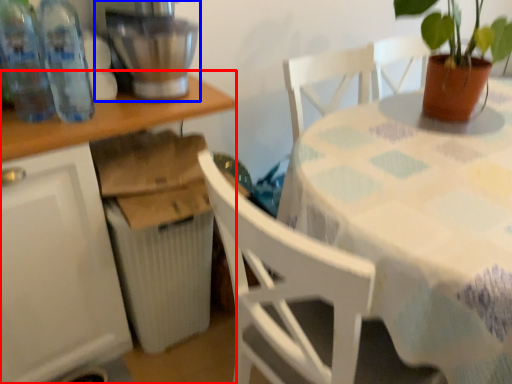
Question: Which of the following is the farthest to the observer, table (highlighted by a red box) or mixer (highlighted by a blue box)?

Choices:
 (A) table
 (B) mixer

Answer: (B)